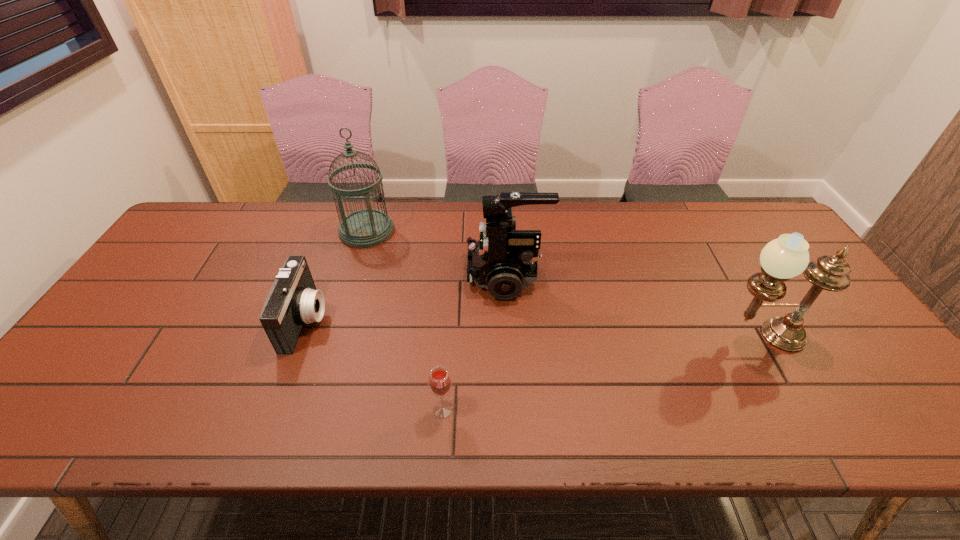
Locate an element on the screen. The image size is (960, 540). free location that satisfies the following two spatial constraints: 1. on the lens of the oil lamp; 2. on the right side of the shorter camcorder is located at coordinates (300, 336).

The image size is (960, 540). Identify the location of vacant region that satisfies the following two spatial constraints: 1. on the front-facing side of the birdcage; 2. on the right side of the nearest object. (314, 409).

Image resolution: width=960 pixels, height=540 pixels. I want to click on free space that satisfies the following two spatial constraints: 1. on the front-facing side of the farthest object; 2. on the lens of the left camcorder, so click(x=340, y=320).

I want to click on free location that satisfies the following two spatial constraints: 1. on the back side of the oil lamp; 2. on the lens mount of the third tallest object, so click(x=727, y=276).

This screenshot has height=540, width=960. I want to click on vacant space that satisfies the following two spatial constraints: 1. on the front-facing side of the birdcage; 2. on the right side of the nearest object, so click(x=314, y=409).

Locate an element on the screen. The image size is (960, 540). vacant point that satisfies the following two spatial constraints: 1. on the front-facing side of the farthest object; 2. on the left side of the oil lamp is located at coordinates (335, 336).

The image size is (960, 540). In order to click on vacant point that satisfies the following two spatial constraints: 1. on the lens mount of the second object from right to left; 2. on the front side of the wineglass in this screenshot , I will do `click(516, 409)`.

Where is `vacant area in the image that satisfies the following two spatial constraints: 1. on the lens of the left camcorder; 2. on the back side of the nearest object`? The height and width of the screenshot is (540, 960). vacant area in the image that satisfies the following two spatial constraints: 1. on the lens of the left camcorder; 2. on the back side of the nearest object is located at coordinates (273, 409).